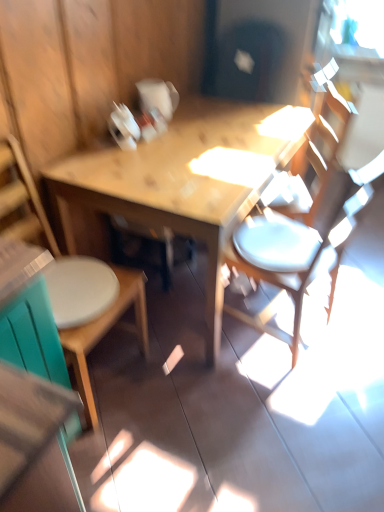
This screenshot has width=384, height=512. In order to click on vacant area on top of wooden table at center (from a real-world perspective) in this screenshot , I will do `click(196, 135)`.